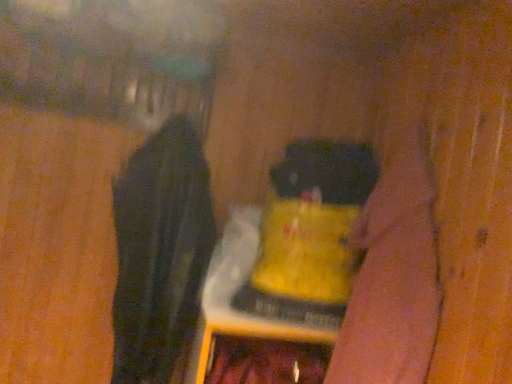
Identify the location of yellow matte bottle at center. The width and height of the screenshot is (512, 384). (310, 233).

The image size is (512, 384). In order to click on velvety black cat at center in this screenshot , I will do `click(326, 172)`.

From a real-world perspective, between yellow matte bottle at center and black fabric at left, who is vertically higher?

In real-world perspective, yellow matte bottle at center is above.

Is yellow matte bottle at center thinner than black fabric at left?

No.

Would you say yellow matte bottle at center is to the left or to the right of black fabric at left in the picture?

yellow matte bottle at center is positioned on black fabric at left's right side.

Considering the sizes of black fabric at left and yellow matte bottle at center in the image, is black fabric at left wider or thinner than yellow matte bottle at center?

Considering their sizes, black fabric at left looks slimmer than yellow matte bottle at center.

Locate an element on the screen. This screenshot has width=512, height=384. clothing lying on the left of yellow matte bottle at center is located at coordinates point(160,252).

Looking at the image, does black fabric at left seem bigger or smaller compared to yellow matte bottle at center?

Clearly, black fabric at left is larger in size than yellow matte bottle at center.

Considering the points (126, 165) and (234, 307), which point is in front, point (126, 165) or point (234, 307)?

Point (234, 307)

From a real-world perspective, which object rests below the other?

black fabric at left.

Can you tell me how much black fabric at left and velvety black cat at center differ in facing direction?

The facing directions of black fabric at left and velvety black cat at center are 5.73e-05 degrees apart.

Does black fabric at left contain velvety black cat at center?

Actually, velvety black cat at center is outside black fabric at left.

Is black fabric at left bigger or smaller than velvety black cat at center?

black fabric at left is bigger than velvety black cat at center.

From the image's perspective, which is below, yellow matte bottle at center or velvety black cat at center?

yellow matte bottle at center, from the image's perspective.

Which point is more forward, (311, 262) or (370, 160)?

The point (311, 262) is closer to the camera.

How many degrees apart are the facing directions of yellow matte bottle at center and velvety black cat at center?

The facing directions of yellow matte bottle at center and velvety black cat at center are 2.07e-05 degrees apart.

Between yellow matte bottle at center and velvety black cat at center, which one has less height?

velvety black cat at center is shorter.

Which is behind, velvety black cat at center or black fabric at left?

velvety black cat at center is further from the camera.

From a real-world perspective, is velvety black cat at center physically located above or below black fabric at left?

From a real-world perspective, velvety black cat at center is physically above black fabric at left.

From the image's perspective, is velvety black cat at center located above or below black fabric at left?

Based on their image positions, velvety black cat at center is located above black fabric at left.

The image size is (512, 384). In order to click on animal that appears behind the yellow matte bottle at center in this screenshot , I will do `click(326, 172)`.

From a real-world perspective, which is physically above, velvety black cat at center or yellow matte bottle at center?

From a 3D spatial view, velvety black cat at center is above.

In the scene shown: From the image's perspective, which one is positioned lower, velvety black cat at center or yellow matte bottle at center?

yellow matte bottle at center, from the image's perspective.

Between velvety black cat at center and yellow matte bottle at center, which one has less height?

With less height is velvety black cat at center.

At what (x,y) coordinates should I click in order to perform the action: click on clothing above the yellow matte bottle at center (from the image's perspective). Please return your answer as a coordinate pair (x, y). Looking at the image, I should click on (160, 252).

Locate an element on the screen. The width and height of the screenshot is (512, 384). bottle above the black fabric at left (from a real-world perspective) is located at coordinates (310, 233).

When comparing their distances from velvety black cat at center, does yellow matte bottle at center or black fabric at left seem further?

black fabric at left.

Consider the image. Looking at the image, which one is located closer to yellow matte bottle at center, velvety black cat at center or black fabric at left?

The object closer to yellow matte bottle at center is velvety black cat at center.

When comparing their distances from black fabric at left, does velvety black cat at center or yellow matte bottle at center seem closer?

Among the two, yellow matte bottle at center is located nearer to black fabric at left.

Estimate the real-world distances between objects in this image. Which object is closer to velvety black cat at center, black fabric at left or yellow matte bottle at center?

yellow matte bottle at center is positioned closer to the anchor velvety black cat at center.

From the image, which object appears to be nearer to black fabric at left, yellow matte bottle at center or velvety black cat at center?

yellow matte bottle at center lies closer to black fabric at left than the other object.

Looking at the image, which one is located further to yellow matte bottle at center, black fabric at left or velvety black cat at center?

black fabric at left is further to yellow matte bottle at center.

You are a GUI agent. You are given a task and a screenshot of the screen. Output one action in this format:
    pyautogui.click(x=<x>, y=<y>)
    Task: Click on the bottle between black fabric at left and velvety black cat at center from left to right
    Image resolution: width=512 pixels, height=384 pixels.
    Given the screenshot: What is the action you would take?
    pyautogui.click(x=310, y=233)